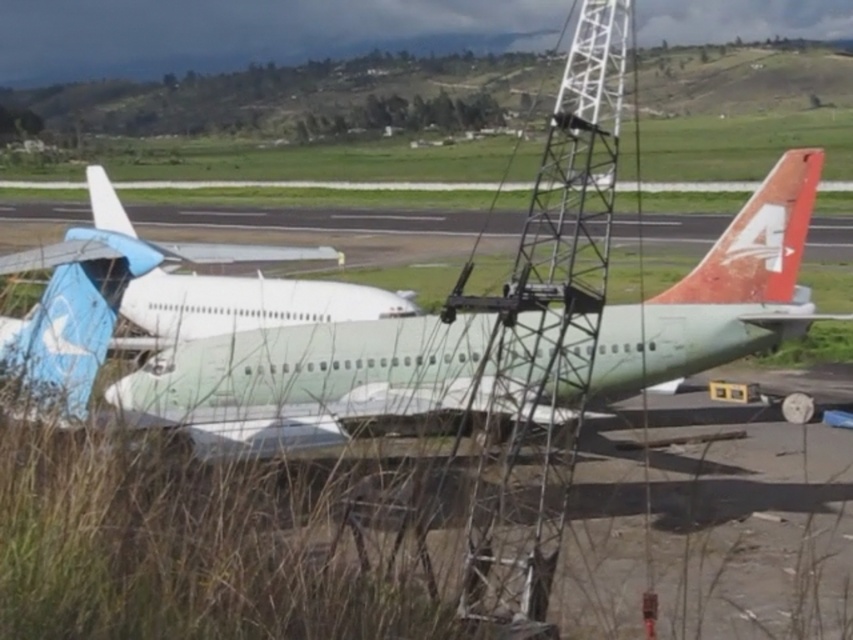
Consider the image. You are a pilot standing on the grassy area in the foreground of the image. You need to board the white matte airplane at center and the rusty orange tail fin at right. Which airplane should you approach first if you want to board the one closer to you?

The white matte airplane at center is closer to you since it is positioned to the left of the rusty orange tail fin at right, which is further away on the right side of the image.

You are standing at the point marked by the coordinates point (x=271, y=372). Based on the scene description, what object are you directly at?

The point (x=271, y=372) marks the white matte airplane at center.

You are a pilot planning to park your small aircraft in this airfield. You see the white matte airplane at center and the rusty orange tail fin at right. Which of these two objects takes up more space in the image?

The white matte airplane at center takes up more space in the image because it is bigger than the rusty orange tail fin at right.